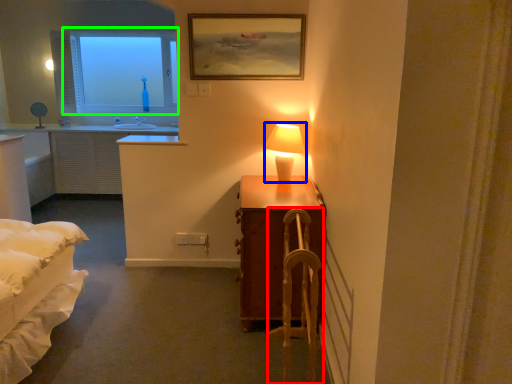
Question: Which is nearer to the armchair (highlighted by a red box)? table lamp (highlighted by a blue box) or window (highlighted by a green box).

Choices:
 (A) table lamp
 (B) window

Answer: (A)